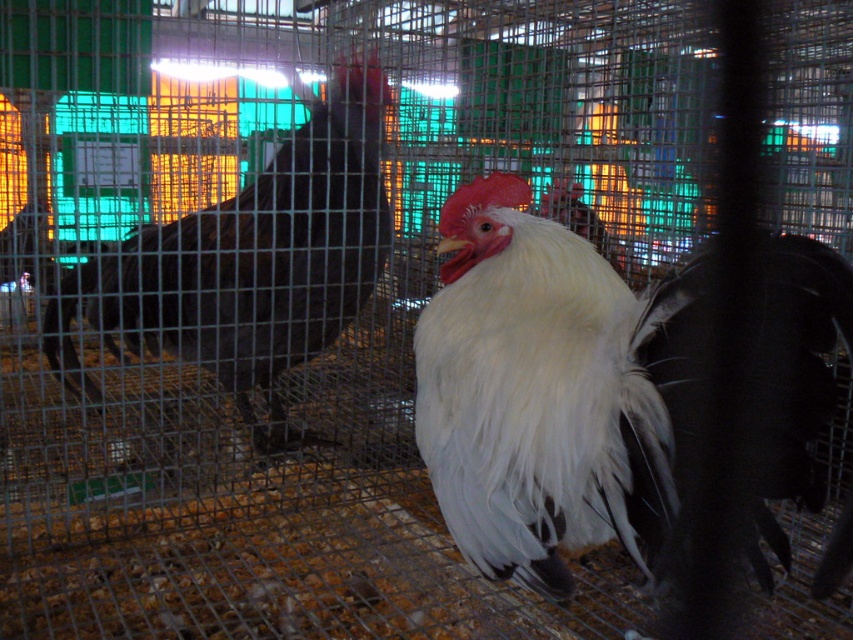
Does white fluffy rooster at center lie in front of black glossy rooster at center?

Yes.

Which is more to the left, white fluffy rooster at center or black glossy rooster at center?

From the viewer's perspective, black glossy rooster at center appears more on the left side.

Where is `white fluffy rooster at center`? Image resolution: width=853 pixels, height=640 pixels. white fluffy rooster at center is located at coordinates (538, 394).

The image size is (853, 640). I want to click on white fluffy rooster at center, so click(538, 394).